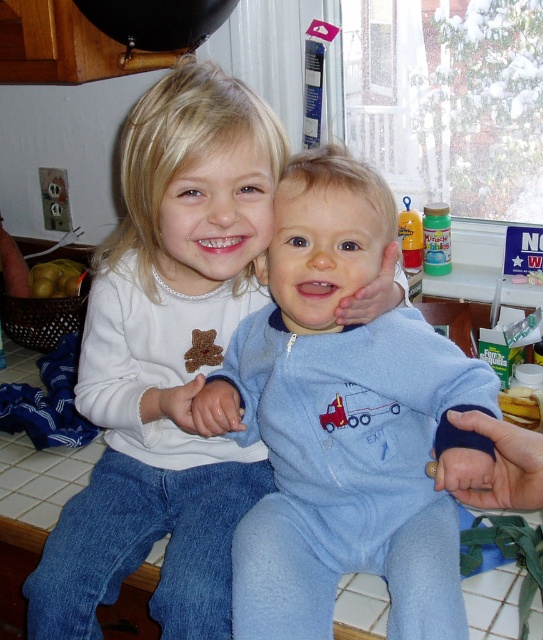
You are a parent preparing to dress your child. You have two options in front of you, the matte white shirt at center and the blue fleece onesie at center. Which one is bigger in size?

The matte white shirt at center is larger in size compared to the blue fleece onesie at center.

You are a photographer taking a picture of the two children in the kitchen. You notice two points marked as point 1 and point 2 in the image. If point 1 is at coordinates [94,401] and point 2 is at [312,493], which point is closer to your camera?

Point 1 at coordinates [94,401] is closer to the camera than point 2 at [312,493] because the description states that point [94,401] is further to the camera than point [312,493]. Wait, there seems to be a contradiction here. Let me check again. The Objects Description says that point [94,401] is further to the camera than point [312,493]. Therefore, point 2 is closer to the camera than point 1.